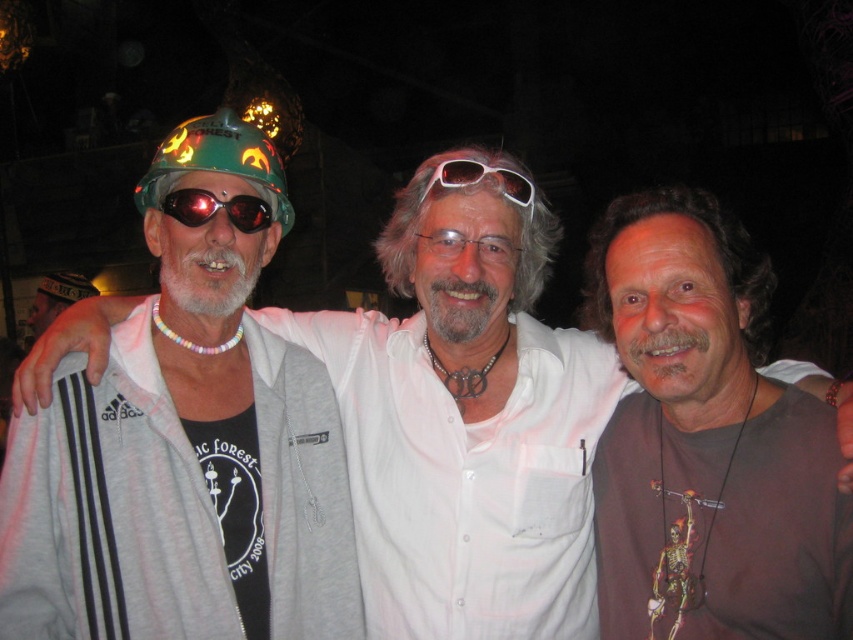
Who is higher up, matte green helmet at left or white plastic sunglasses at center?

white plastic sunglasses at center is above.

Does matte green helmet at left have a lesser width compared to white plastic sunglasses at center?

No.

In order to click on matte green helmet at left in this screenshot , I will do `click(186, 448)`.

Is point (525, 198) positioned before point (57, 276)?

Yes, it is.

Is point (450, 163) less distant than point (53, 320)?

Yes.

This screenshot has width=853, height=640. I want to click on white plastic sunglasses at center, so click(480, 179).

Is matte green helmet at left below white leather hat at left?

→ Indeed, matte green helmet at left is positioned under white leather hat at left.

Is point (207, 556) less distant than point (47, 308)?

Yes, point (207, 556) is closer to viewer.

Who is more distant from viewer, (166, 524) or (96, 292)?

The point (96, 292) is more distant.

The width and height of the screenshot is (853, 640). What are the coordinates of `matte green helmet at left` in the screenshot? It's located at (186, 448).